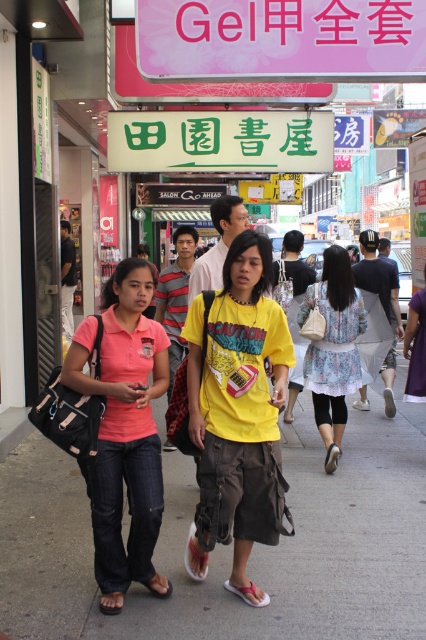
Question: Which point is farther from the camera taking this photo?

Choices:
 (A) (233, 525)
 (B) (331, 132)
 (C) (316, 376)
 (D) (129, 504)

Answer: (B)

Question: Which point appears closest to the camera in this image?

Choices:
 (A) (313, 307)
 (B) (256, 317)
 (C) (184, 8)

Answer: (B)

Question: Estimate the real-world distances between objects in this image. Which object is closer to the floral fabric dress at center?

Choices:
 (A) pink fabric shirt at center
 (B) green plastic sign at center

Answer: (A)

Question: Is yellow matte t-shirt at center above floral fabric dress at center?

Choices:
 (A) no
 (B) yes

Answer: (A)

Question: Does gray concrete sidewalk at center appear on the left side of pink fabric shirt at center?

Choices:
 (A) yes
 (B) no

Answer: (B)

Question: Can you confirm if gray concrete sidewalk at center is smaller than floral fabric dress at center?

Choices:
 (A) yes
 (B) no

Answer: (A)